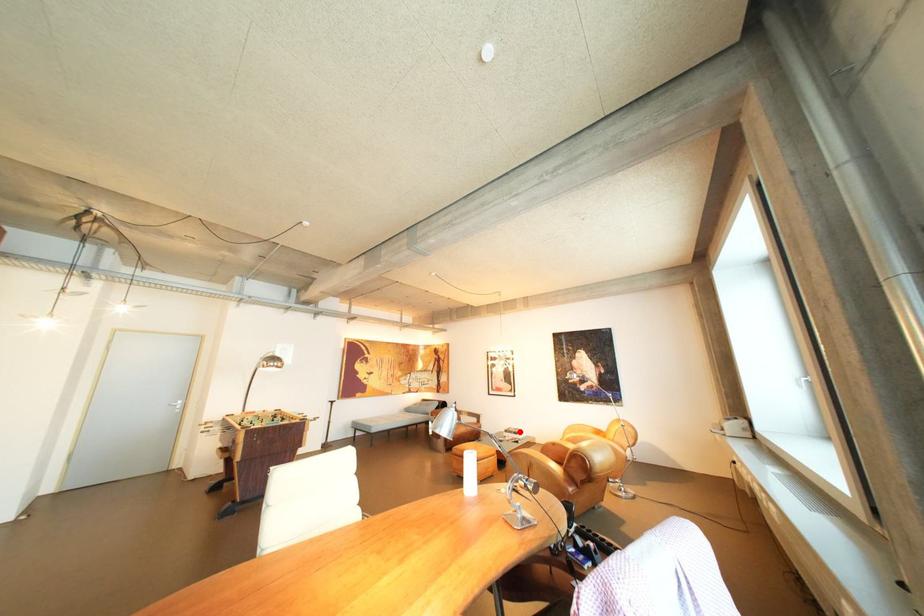
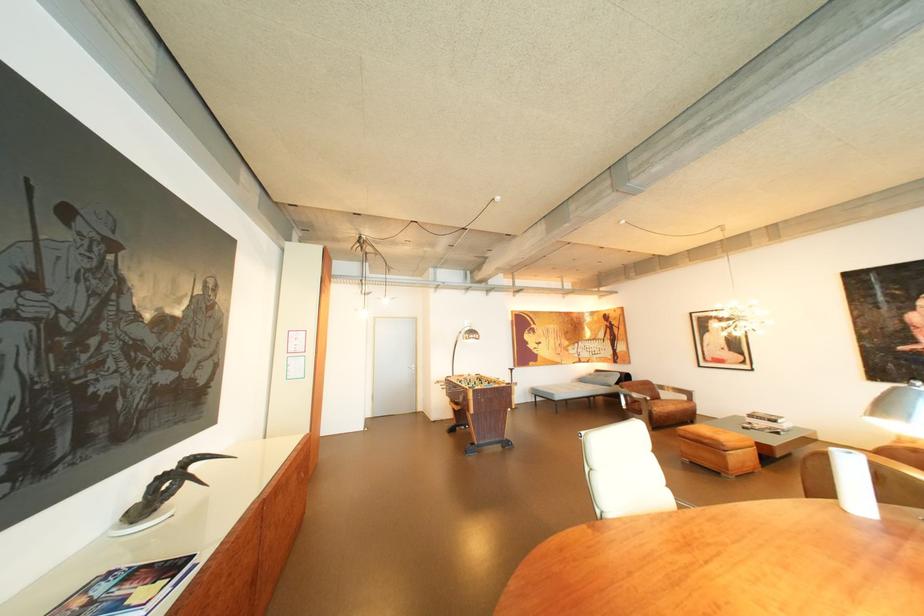
The point at the highlighted location is marked in the first image. Where is the corresponding point in the second image?

(763, 416)